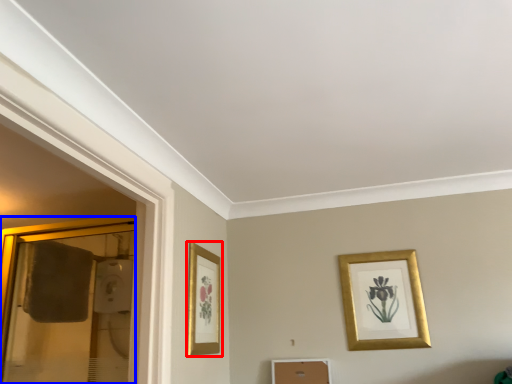
Question: Which object appears farthest to the camera in this image, picture frame (highlighted by a red box) or glass door (highlighted by a blue box)?

Choices:
 (A) picture frame
 (B) glass door

Answer: (A)